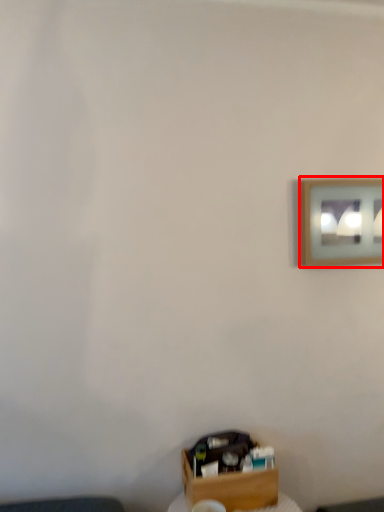
Question: Considering the relative positions of picture frame (annotated by the red box) and box in the image provided, where is picture frame (annotated by the red box) located with respect to the staircase?

Choices:
 (A) right
 (B) left

Answer: (A)